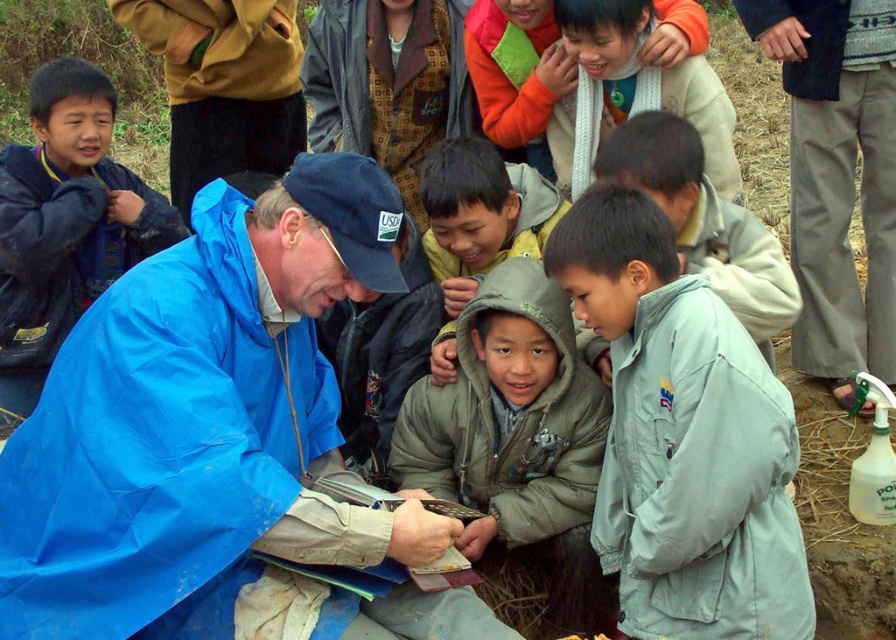
You are a fashion designer observing the children in the scene. You need to determine which jacket would be more suitable for a rainy day based on their appearance. Which one would you recommend between the matte black jacket at left and the blue waterproof jacket at left?

The blue waterproof jacket at left is more suitable for a rainy day because it is thicker than the matte black jacket at left, providing better protection against the rain and cold.

You are a photographer trying to capture a clear shot of the matte black jacket at left and the orange fleece jacket at upper center. Since you want both subjects to be in focus, which one should you focus on first to ensure the other is also sharp?

The matte black jacket at left is located below the orange fleece jacket at upper center. To ensure both are in focus, focus on the matte black jacket at left since it is closer to the camera, and the orange fleece jacket at upper center will naturally fall into the depth of field.